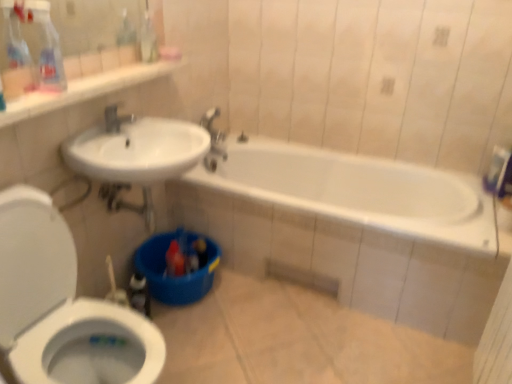
Question: Considering the positions of white glossy toilet at lower left and translucent plastic spray bottle at upper left in the image, is white glossy toilet at lower left bigger or smaller than translucent plastic spray bottle at upper left?

Choices:
 (A) big
 (B) small

Answer: (A)

Question: Considering the positions of white glossy toilet at lower left and translucent plastic spray bottle at upper left in the image, is white glossy toilet at lower left taller or shorter than translucent plastic spray bottle at upper left?

Choices:
 (A) short
 (B) tall

Answer: (B)

Question: Which of these objects is positioned closest to the silver metallic faucet at upper center?

Choices:
 (A) white glossy toilet at lower left
 (B) translucent plastic spray bottle at upper left

Answer: (B)

Question: Which object is positioned closest to the silver metallic faucet at upper center?

Choices:
 (A) translucent plastic spray bottle at upper left
 (B) white glossy toilet at lower left

Answer: (A)